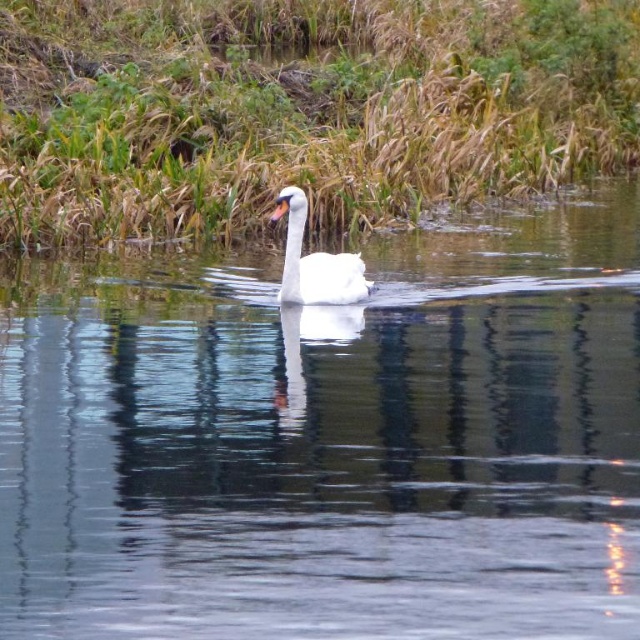
Question: Which point is closer to the camera?

Choices:
 (A) green grass at center
 (B) clear water at center

Answer: (B)

Question: Which object appears farthest from the camera in this image?

Choices:
 (A) clear water at center
 (B) green grass at center
 (C) white glossy swan at center

Answer: (B)

Question: Does clear water at center appear over green grass at center?

Choices:
 (A) yes
 (B) no

Answer: (B)

Question: Does clear water at center have a greater width compared to white glossy swan at center?

Choices:
 (A) yes
 (B) no

Answer: (A)

Question: Among these objects, which one is farthest from the camera?

Choices:
 (A) clear water at center
 (B) white glossy swan at center

Answer: (B)

Question: Is clear water at center smaller than white glossy swan at center?

Choices:
 (A) yes
 (B) no

Answer: (B)